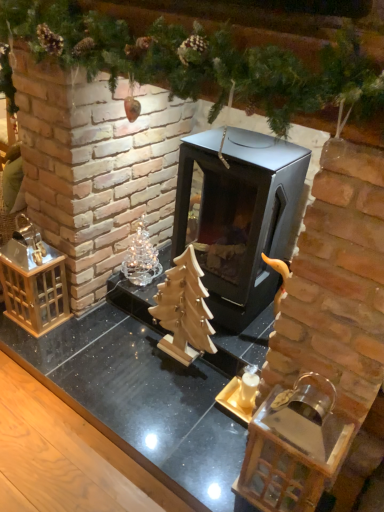
Find the location of a particular element. The image size is (384, 512). wooden christmas tree at center is located at coordinates (184, 309).

What do you see at coordinates (141, 258) in the screenshot? The width and height of the screenshot is (384, 512). I see `clear glass ornament at center left` at bounding box center [141, 258].

This screenshot has width=384, height=512. In order to click on black metal fireplace at center in this screenshot , I will do `click(239, 216)`.

Where is `fireplace above the wooden christmas tree at center (from a real-world perspective)`? fireplace above the wooden christmas tree at center (from a real-world perspective) is located at coordinates (239, 216).

Considering the relative sizes of wooden christmas tree at center and black metal fireplace at center in the image provided, is wooden christmas tree at center thinner than black metal fireplace at center?

Correct, the width of wooden christmas tree at center is less than that of black metal fireplace at center.

Is wooden christmas tree at center not near black metal fireplace at center?

Actually, wooden christmas tree at center and black metal fireplace at center are a little close together.

How far apart are wooden christmas tree at center and black metal fireplace at center?

wooden christmas tree at center and black metal fireplace at center are 11.22 inches apart from each other.

Is the position of wooden christmas tree at center less distant than that of clear glass ornament at center left?

Yes, the depth of wooden christmas tree at center is less than that of clear glass ornament at center left.

Is wooden christmas tree at center not within clear glass ornament at center left?

Yes, wooden christmas tree at center is not within clear glass ornament at center left.

From the image's perspective, is wooden christmas tree at center above or below clear glass ornament at center left?

Based on their image positions, wooden christmas tree at center is located beneath clear glass ornament at center left.

Is wooden christmas tree at center facing towards clear glass ornament at center left?

No, wooden christmas tree at center is not oriented towards clear glass ornament at center left.

Considering the sizes of objects clear glass ornament at center left and wooden christmas tree at center in the image provided, who is wider, clear glass ornament at center left or wooden christmas tree at center?

With larger width is clear glass ornament at center left.

Is wooden christmas tree at center a part of clear glass ornament at center left?

That's incorrect, wooden christmas tree at center is not inside clear glass ornament at center left.

Which point is more forward, [130,261] or [168,291]?

Positioned in front is point [168,291].

Which object is positioned more to the left, clear glass ornament at center left or wooden christmas tree at center?

From the viewer's perspective, clear glass ornament at center left appears more on the left side.

From a real-world perspective, is clear glass ornament at center left located higher than black metal fireplace at center?

Actually, clear glass ornament at center left is physically below black metal fireplace at center in the real world.

At what (x,y) coordinates should I click in order to perform the action: click on fireplace above the clear glass ornament at center left (from a real-world perspective). Please return your answer as a coordinate pair (x, y). The height and width of the screenshot is (512, 384). Looking at the image, I should click on (239, 216).

Between clear glass ornament at center left and black metal fireplace at center, which one has larger size?

With larger size is black metal fireplace at center.

Which is correct: clear glass ornament at center left is inside black metal fireplace at center, or outside of it?

clear glass ornament at center left cannot be found inside black metal fireplace at center.

Is black metal fireplace at center at the right side of clear glass ornament at center left?

Yes.

Considering the positions of point (219, 137) and point (139, 275), is point (219, 137) closer or farther from the camera than point (139, 275)?

Point (219, 137) is positioned closer to the camera compared to point (139, 275).

Locate an element on the screen. Image resolution: width=384 pixels, height=512 pixels. fireplace in front of the clear glass ornament at center left is located at coordinates (239, 216).

From a real-world perspective, which is physically above, black metal fireplace at center or clear glass ornament at center left?

black metal fireplace at center, from a real-world perspective.

What's the angular difference between black metal fireplace at center and wooden christmas tree at center's facing directions?

0.00284 degrees separate the facing orientations of black metal fireplace at center and wooden christmas tree at center.

Which object is further away from the camera taking this photo, black metal fireplace at center or wooden christmas tree at center?

wooden christmas tree at center is further from the camera.

Is black metal fireplace at center to the left or to the right of wooden christmas tree at center in the image?

black metal fireplace at center is positioned on wooden christmas tree at center's right side.

Is black metal fireplace at center situated inside wooden christmas tree at center or outside?

black metal fireplace at center is not inside wooden christmas tree at center, it's outside.

Identify the location of fireplace in front of the wooden christmas tree at center. The height and width of the screenshot is (512, 384). (239, 216).

The width and height of the screenshot is (384, 512). What are the coordinates of `christmas decoration on the left of wooden christmas tree at center` in the screenshot? It's located at (141, 258).

From the image, which object appears to be nearer to black metal fireplace at center, wooden christmas tree at center or clear glass ornament at center left?

Based on the image, wooden christmas tree at center appears to be nearer to black metal fireplace at center.

Considering their positions, is clear glass ornament at center left positioned further to wooden christmas tree at center than black metal fireplace at center?

clear glass ornament at center left is positioned further to the anchor wooden christmas tree at center.

Estimate the real-world distances between objects in this image. Which object is closer to clear glass ornament at center left, wooden christmas tree at center or black metal fireplace at center?

The object closer to clear glass ornament at center left is wooden christmas tree at center.

Estimate the real-world distances between objects in this image. Which object is further from wooden christmas tree at center, black metal fireplace at center or clear glass ornament at center left?

clear glass ornament at center left is positioned further to the anchor wooden christmas tree at center.

When comparing their distances from clear glass ornament at center left, does black metal fireplace at center or wooden christmas tree at center seem closer?

Among the two, wooden christmas tree at center is located nearer to clear glass ornament at center left.

Consider the image. When comparing their distances from black metal fireplace at center, does clear glass ornament at center left or wooden christmas tree at center seem closer?

wooden christmas tree at center is closer to black metal fireplace at center.

The image size is (384, 512). In order to click on christmas tree between black metal fireplace at center and clear glass ornament at center left in the front-back direction in this screenshot , I will do `click(184, 309)`.